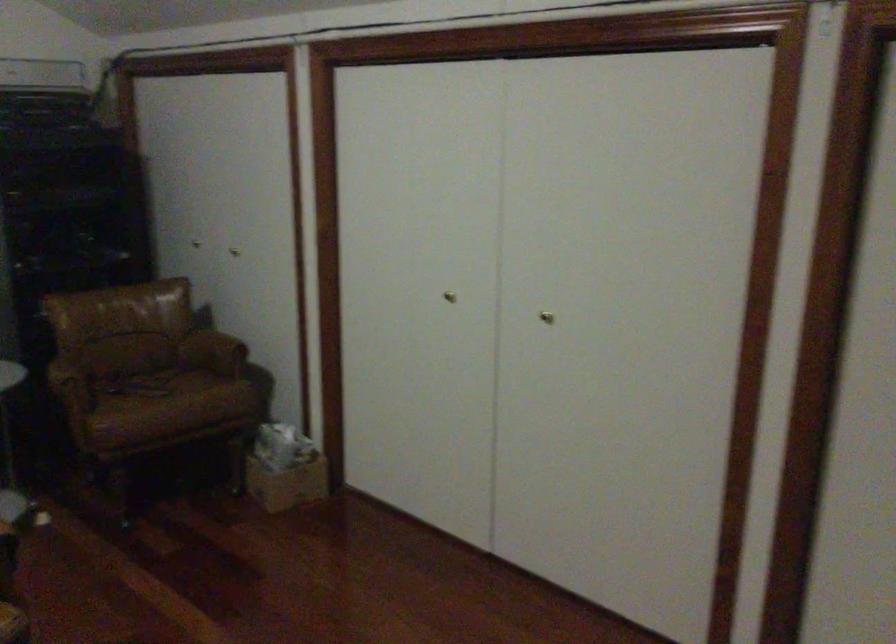
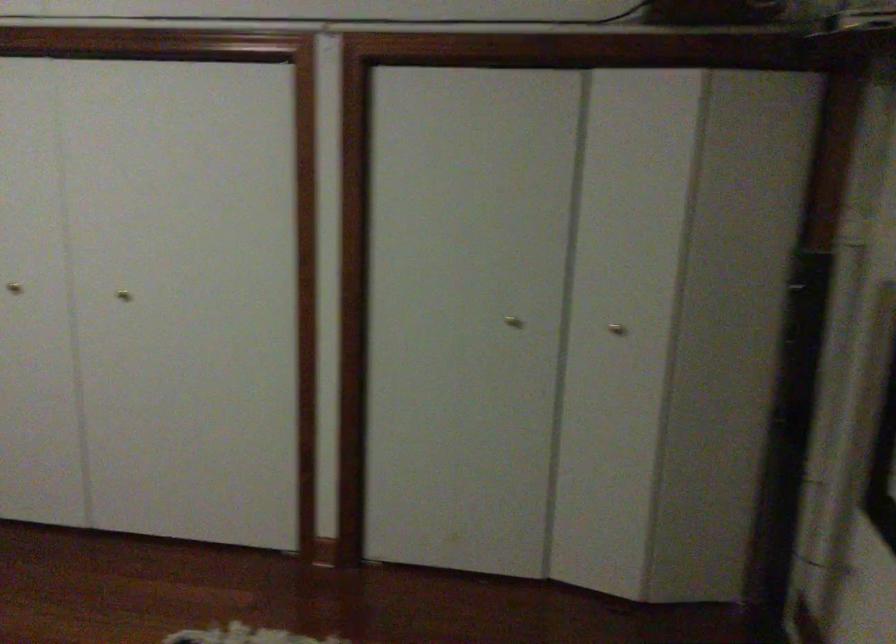
Question: How did the camera likely rotate?

Choices:
 (A) Left
 (B) Right
 (C) Up
 (D) Down

Answer: (B)